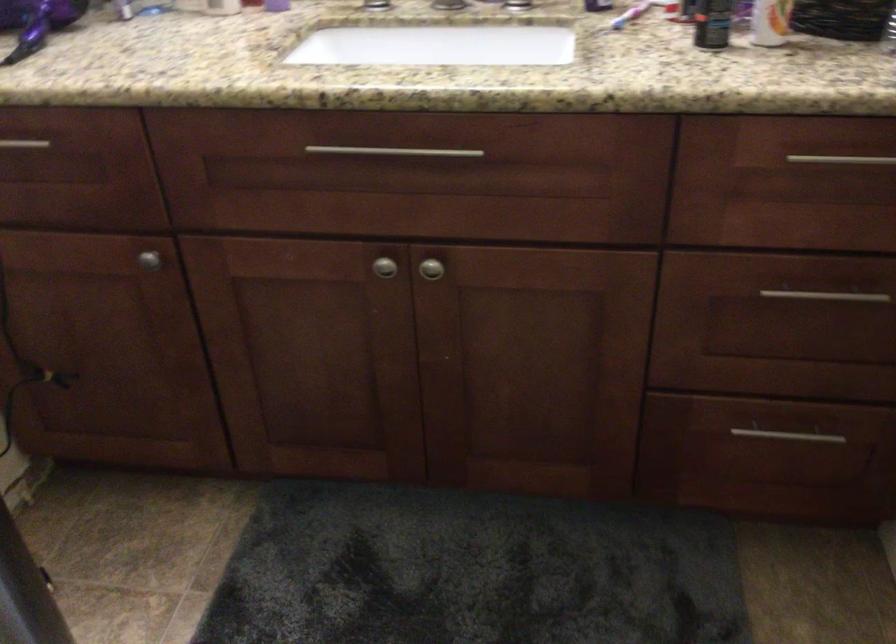
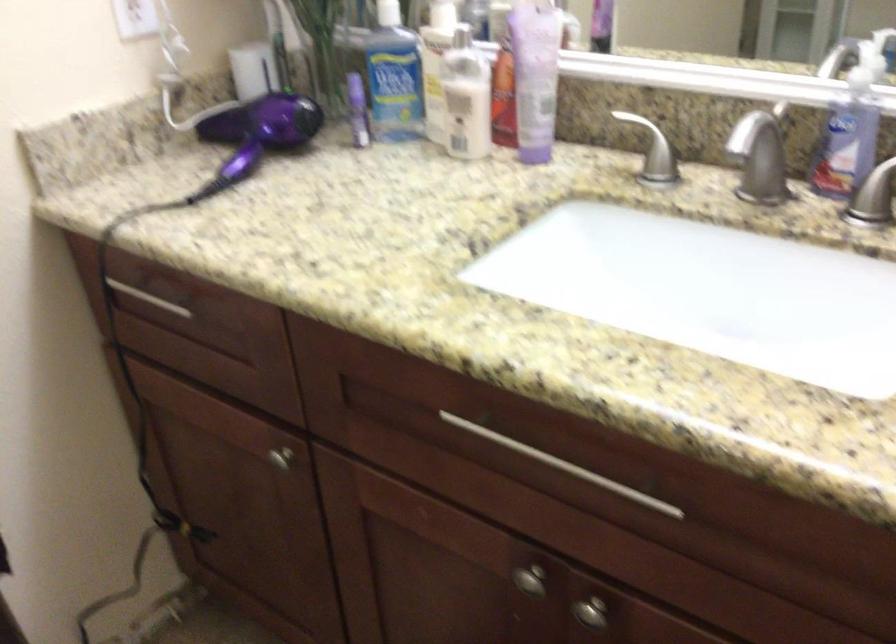
Question: The first image is from the beginning of the video and the second image is from the end. How did the camera likely rotate when shooting the video?

Choices:
 (A) Left
 (B) Right
 (C) Up
 (D) Down

Answer: (A)